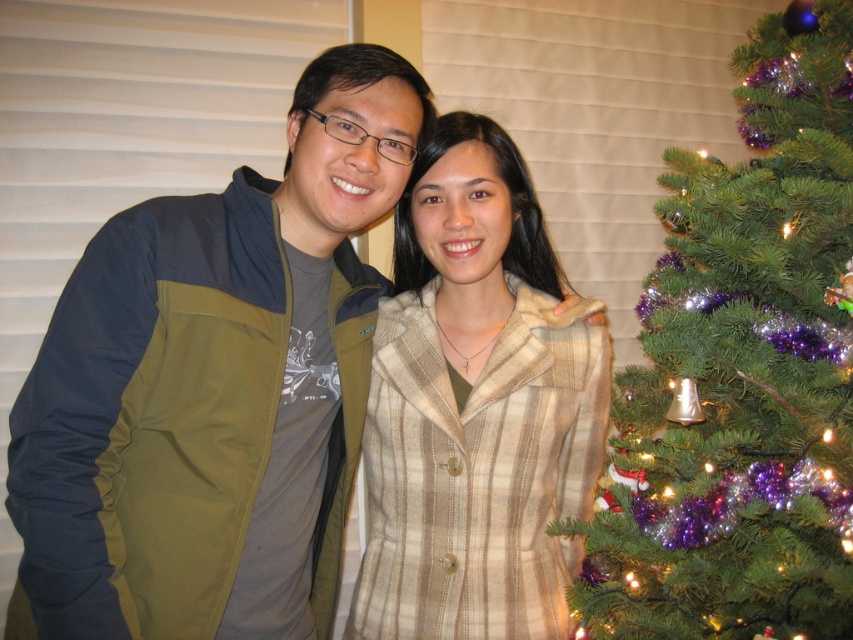
Who is positioned more to the left, matte olive green jacket at center or green shiny pine tree at right?

matte olive green jacket at center is more to the left.

Between point (62, 522) and point (837, 93), which one is positioned behind?

The point (837, 93) is behind.

The image size is (853, 640). Identify the location of matte olive green jacket at center. (213, 387).

Is point (703, 496) closer to camera compared to point (410, 481)?

That is False.

The height and width of the screenshot is (640, 853). Describe the element at coordinates (741, 372) in the screenshot. I see `green shiny pine tree at right` at that location.

Find the location of a particular element. The width and height of the screenshot is (853, 640). green shiny pine tree at right is located at coordinates (741, 372).

Does point (279, 560) come farther from viewer compared to point (399, 211)?

No, (279, 560) is closer to viewer.

Measure the distance between matte olive green jacket at center and camera.

matte olive green jacket at center is 34.93 inches away from camera.

I want to click on matte olive green jacket at center, so click(213, 387).